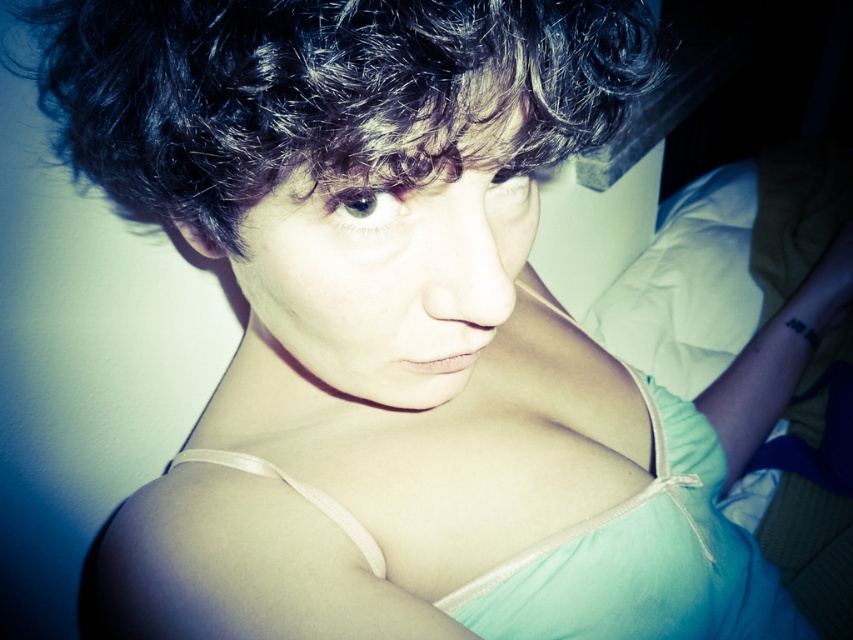
You are a photographer adjusting the lighting for a portrait. The subject has a smooth skin face at center and a light teal fabric dress at center. Which object should you focus on first if you want to ensure proper exposure, considering their sizes?

The smooth skin face at center is thinner than the light teal fabric dress at center, so you should focus on the smooth skin face at center first since it is smaller and requires precise exposure adjustments.

You are a photographer adjusting the focus on your camera. The subject is standing in front of you with their smooth skin face at center and light teal fabric dress at center. To ensure both are in focus, what is the minimum distance you need to set between the face and dress in your camera settings?

The smooth skin face at center and light teal fabric dress at center are 8.78 inches apart. To ensure both are in focus, the minimum distance should be set to at least 8.78 inches.